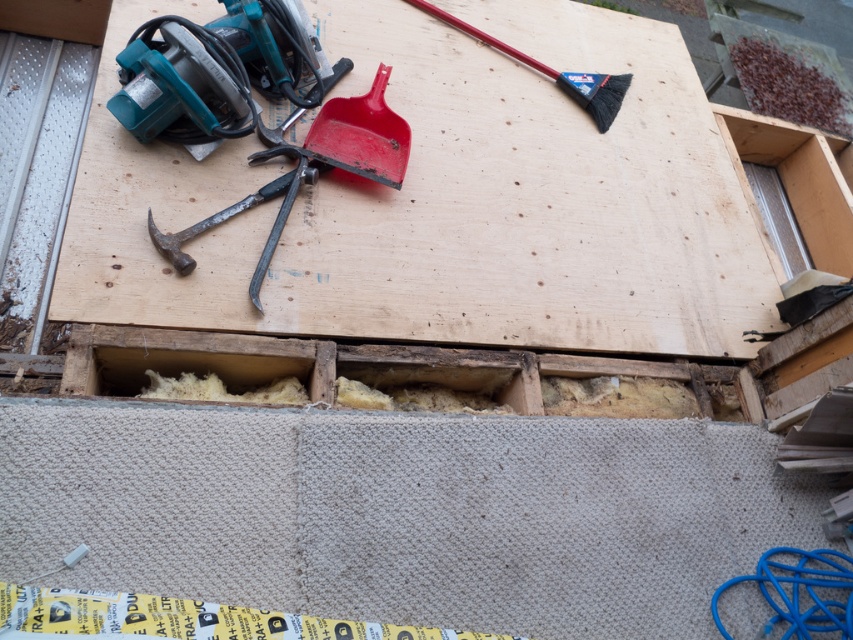
The image size is (853, 640). In order to click on black plastic brush at upper right in this screenshot , I will do `click(554, 72)`.

Does black plastic brush at upper right have a greater height compared to rusty metal hammer at center?

Correct, black plastic brush at upper right is much taller as rusty metal hammer at center.

This screenshot has width=853, height=640. What are the coordinates of `black plastic brush at upper right` in the screenshot? It's located at (554, 72).

Who is shorter, pine wood at center or metallic hammer at left?

metallic hammer at left is shorter.

From the picture: Can you confirm if pine wood at center is smaller than metallic hammer at left?

No.

Describe the element at coordinates (445, 198) in the screenshot. This screenshot has height=640, width=853. I see `pine wood at center` at that location.

Image resolution: width=853 pixels, height=640 pixels. I want to click on pine wood at center, so click(445, 198).

How much distance is there between pine wood at center and rusty metal hammer at center?

pine wood at center and rusty metal hammer at center are 22.49 inches apart from each other.

Which is above, pine wood at center or rusty metal hammer at center?

pine wood at center is above.

Who is more forward, (373,22) or (270,189)?

Point (270,189) is in front.

This screenshot has width=853, height=640. Identify the location of pine wood at center. (445, 198).